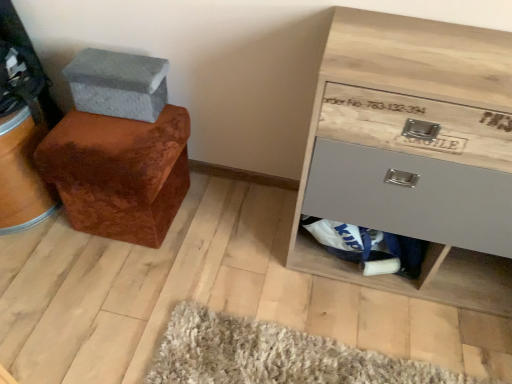
Find the location of a particular element. This screenshot has width=512, height=384. vacant point above velvet brown ottoman at left (from a real-world perspective) is located at coordinates (113, 129).